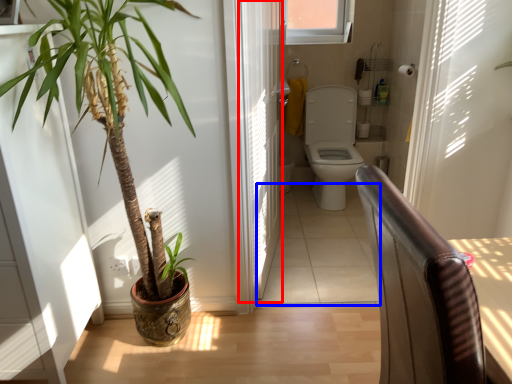
Question: Which object appears farthest to the camera in this image, screen door (highlighted by a red box) or path (highlighted by a blue box)?

Choices:
 (A) screen door
 (B) path

Answer: (B)